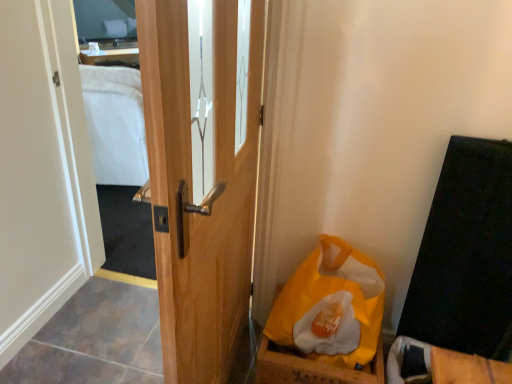
Question: Is clear glass mirror at upper left spatially inside yellow paper bag at lower right, or outside of it?

Choices:
 (A) outside
 (B) inside

Answer: (A)

Question: Is clear glass mirror at upper left to the left or to the right of yellow paper bag at lower right in the image?

Choices:
 (A) left
 (B) right

Answer: (A)

Question: Which object is positioned farthest from the clear glass mirror at upper left?

Choices:
 (A) wooden door at center
 (B) yellow paper bag at lower right

Answer: (B)

Question: Estimate the real-world distances between objects in this image. Which object is closer to the wooden door at center?

Choices:
 (A) yellow paper bag at lower right
 (B) clear glass mirror at upper left

Answer: (A)